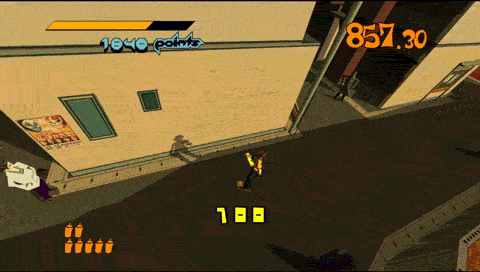
Find the location of `wall`. wall is located at coordinates (453, 79).